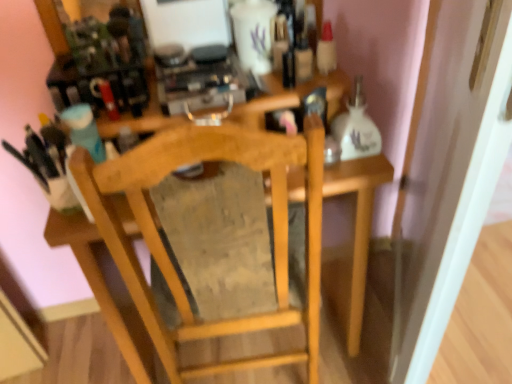
Question: From their relative heights in the image, would you say wooden chair at center is taller or shorter than white glossy door at right?

Choices:
 (A) short
 (B) tall

Answer: (A)

Question: Is wooden chair at center spatially inside white glossy door at right, or outside of it?

Choices:
 (A) outside
 (B) inside

Answer: (A)

Question: Is wooden chair at center to the left or to the right of white glossy door at right in the image?

Choices:
 (A) right
 (B) left

Answer: (B)

Question: From a real-world perspective, is white glossy door at right physically located above or below wooden chair at center?

Choices:
 (A) above
 (B) below

Answer: (A)

Question: From the image's perspective, is white glossy door at right located above or below wooden chair at center?

Choices:
 (A) above
 (B) below

Answer: (A)

Question: Considering the positions of white glossy door at right and wooden chair at center in the image, is white glossy door at right taller or shorter than wooden chair at center?

Choices:
 (A) short
 (B) tall

Answer: (B)

Question: Is white glossy door at right spatially inside wooden chair at center, or outside of it?

Choices:
 (A) inside
 (B) outside

Answer: (B)